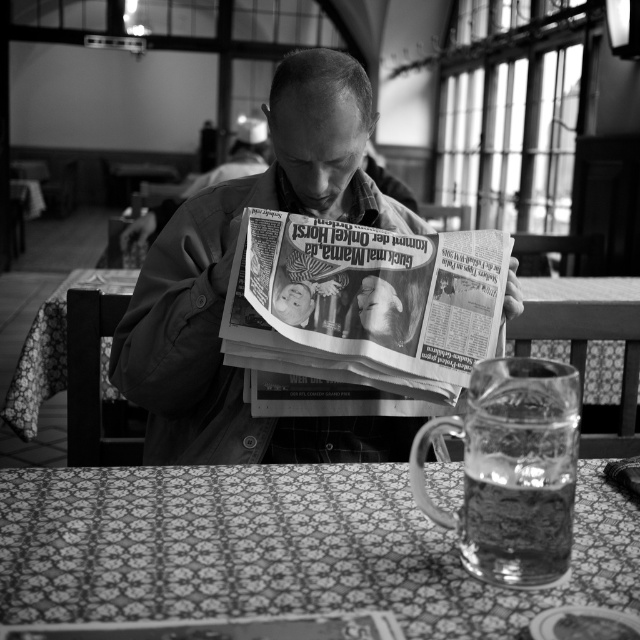
Can you confirm if matte newspaper at center is positioned below printed newspaper at center?

Correct, matte newspaper at center is located below printed newspaper at center.

Who is more forward, (355, 154) or (252, 365)?

Point (252, 365)

Image resolution: width=640 pixels, height=640 pixels. What are the coordinates of `matte newspaper at center` in the screenshot? It's located at (228, 276).

Is patterned fabric table at lower center thinner than matte newspaper at center?

No.

This screenshot has width=640, height=640. I want to click on patterned fabric table at lower center, so click(276, 548).

Which of these two, patterned fabric table at lower center or printed newspaper at center, stands taller?

printed newspaper at center

Is point (269, 586) positioned after point (460, 300)?

No, it is not.

Consider the image. Who is more distant from viewer, (x=4, y=516) or (x=481, y=356)?

Positioned behind is point (x=481, y=356).

Locate an element on the screen. patterned fabric table at lower center is located at coordinates (276, 548).